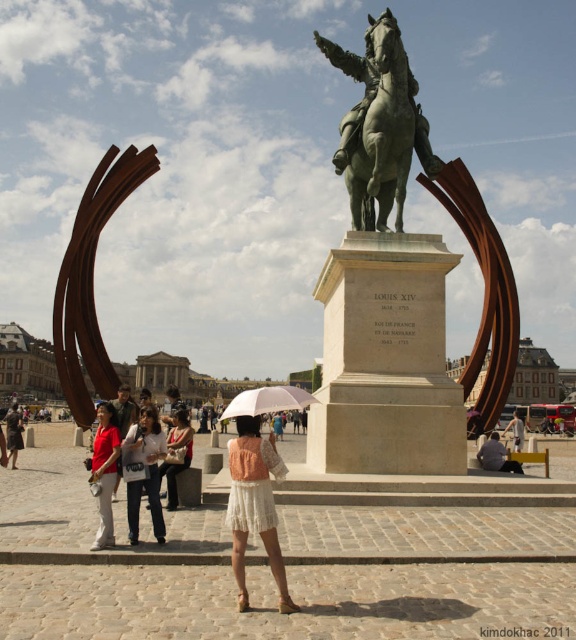
Question: Is green polished bronze statue at center positioned before matte pink umbrella at center?

Choices:
 (A) no
 (B) yes

Answer: (A)

Question: Considering the relative positions of green polished bronze statue at center and white lace dress at center in the image provided, where is green polished bronze statue at center located with respect to white lace dress at center?

Choices:
 (A) above
 (B) below

Answer: (A)

Question: Which of these objects is positioned closest to the white matte umbrella at center?

Choices:
 (A) matte red shirt at lower left
 (B) green polished bronze statue at center
 (C) matte pink umbrella at center
 (D) white lace dress at center

Answer: (D)

Question: Does white cotton shirt at center have a lesser width compared to matte brown jacket at lower left?

Choices:
 (A) no
 (B) yes

Answer: (B)

Question: Among these points, which one is farthest from the camera?

Choices:
 (A) (233, 496)
 (B) (245, 413)
 (C) (399, 237)
 (D) (157, 497)

Answer: (C)

Question: Which object appears closest to the camera in this image?

Choices:
 (A) green polished bronze statue at center
 (B) white lace dress at center
 (C) white matte umbrella at center

Answer: (B)